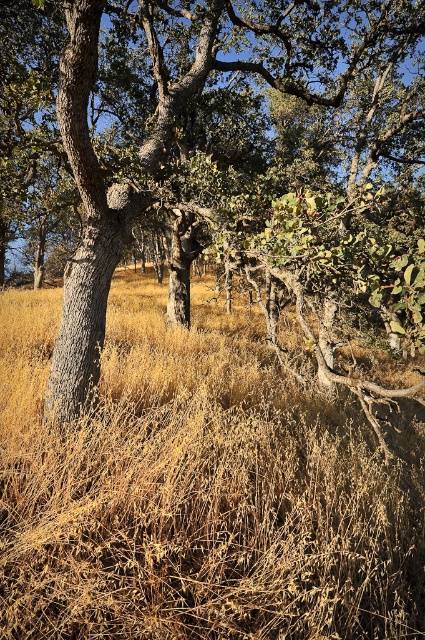
Question: Does smooth bark tree at center appear over dry grass at center?

Choices:
 (A) no
 (B) yes

Answer: (B)

Question: Which object appears closest to the camera in this image?

Choices:
 (A) smooth bark tree at center
 (B) dry grass at center

Answer: (B)

Question: Is smooth bark tree at center behind dry grass at center?

Choices:
 (A) no
 (B) yes

Answer: (B)

Question: Can you confirm if smooth bark tree at center is positioned to the left of dry grass at center?

Choices:
 (A) yes
 (B) no

Answer: (B)